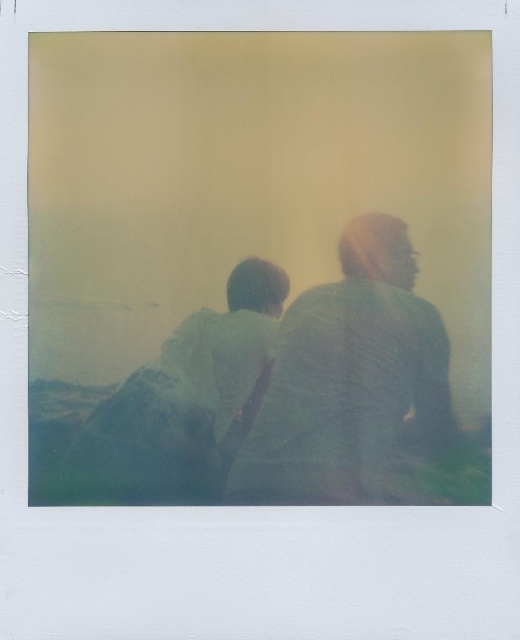
Question: Does textured gray shirt at center have a lesser width compared to green fabric shirt at left?

Choices:
 (A) yes
 (B) no

Answer: (B)

Question: Is textured gray shirt at center wider than green fabric shirt at left?

Choices:
 (A) yes
 (B) no

Answer: (A)

Question: Which object appears farthest from the camera in this image?

Choices:
 (A) green fabric shirt at left
 (B) textured gray shirt at center

Answer: (B)

Question: Which object is farther from the camera taking this photo?

Choices:
 (A) green fabric shirt at left
 (B) textured gray shirt at center

Answer: (B)

Question: Observing the image, what is the correct spatial positioning of textured gray shirt at center in reference to green fabric shirt at left?

Choices:
 (A) below
 (B) above

Answer: (B)